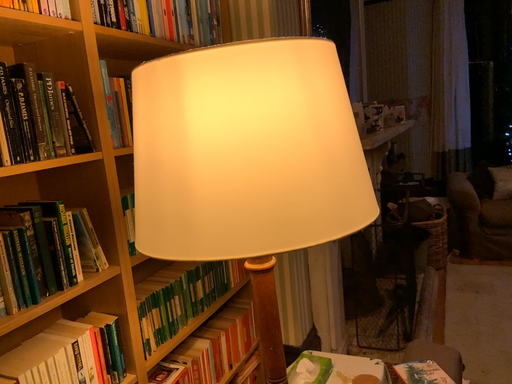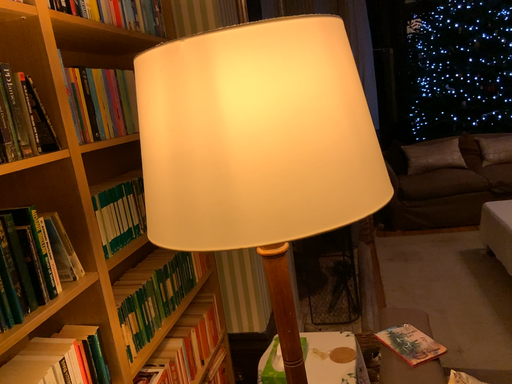
Question: How did the camera likely rotate when shooting the video?

Choices:
 (A) rotated left
 (B) rotated right

Answer: (B)